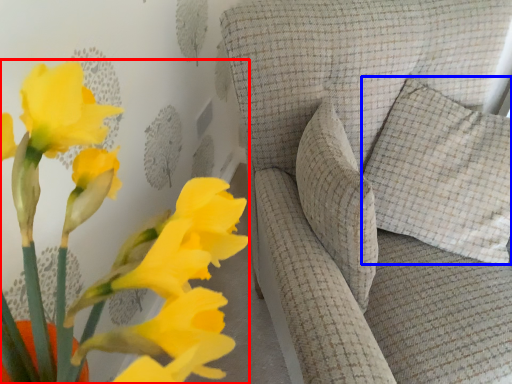
Question: Among these objects, which one is farthest to the camera, floral arrangement (highlighted by a red box) or pillow (highlighted by a blue box)?

Choices:
 (A) floral arrangement
 (B) pillow

Answer: (B)